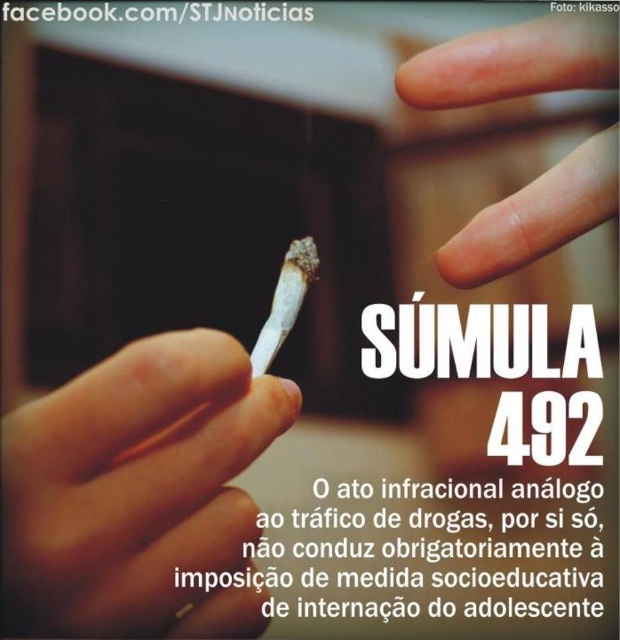
Question: Among these objects, which one is nearest to the camera?

Choices:
 (A) dry skin at upper center
 (B) white matte cigarette at center

Answer: (B)

Question: Can you confirm if white matte cigarette at center is wider than dry skin at upper center?

Choices:
 (A) no
 (B) yes

Answer: (B)

Question: Where is white matte cigarette at center located in relation to dry skin at upper center in the image?

Choices:
 (A) right
 (B) left

Answer: (B)

Question: From the image, what is the correct spatial relationship of white matte cigarette at center in relation to dry skin at upper center?

Choices:
 (A) below
 (B) above

Answer: (A)

Question: Which point is closer to the camera taking this photo?

Choices:
 (A) (x=541, y=80)
 (B) (x=208, y=502)

Answer: (B)

Question: Among these points, which one is farthest from the camera?

Choices:
 (A) (140, 429)
 (B) (591, 52)

Answer: (B)